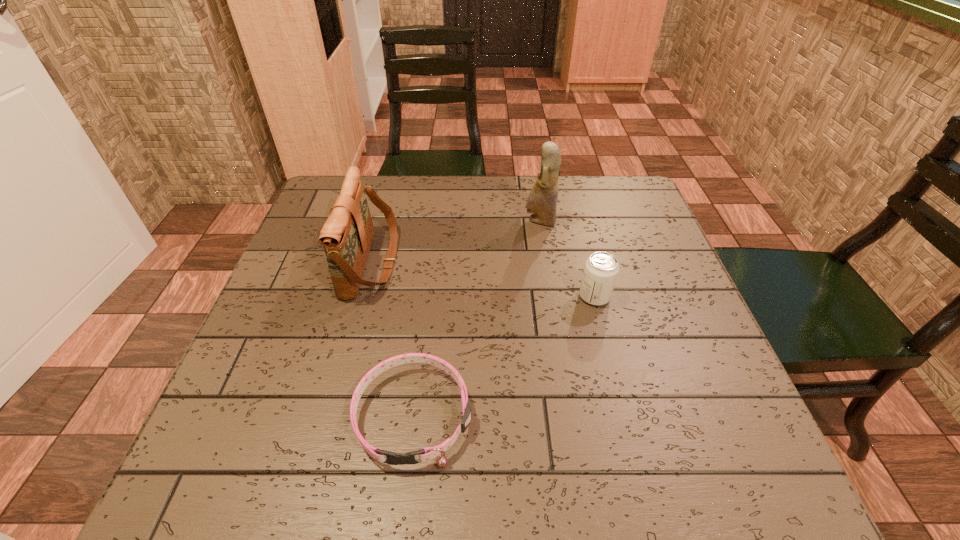
Image resolution: width=960 pixels, height=540 pixels. Find the location of `free space that is in between the figurine and the third tallest object`. free space that is in between the figurine and the third tallest object is located at coordinates (567, 259).

You are a GUI agent. You are given a task and a screenshot of the screen. Output one action in this format:
    pyautogui.click(x=<x>, y=<y>)
    Task: Click on the free space between the tallest object and the third shortest object
    
    Given the screenshot: What is the action you would take?
    pyautogui.click(x=456, y=241)

Where is `object identified as the closest to the rightmost object`? object identified as the closest to the rightmost object is located at coordinates click(x=542, y=200).

Identify the location of object identified as the closest to the tallest object. The image size is (960, 540). (601, 269).

At what (x,y) coordinates should I click in order to perform the action: click on free spot that satisfies the following two spatial constraints: 1. on the front-facing side of the figurine; 2. on the back side of the third tallest object. Please return your answer as a coordinate pair (x, y). This screenshot has width=960, height=540. Looking at the image, I should click on [x=552, y=296].

Identify the location of vacant region that satisfies the following two spatial constraints: 1. on the front-facing side of the figurine; 2. on the right side of the rightmost object. This screenshot has height=540, width=960. (552, 296).

You are a GUI agent. You are given a task and a screenshot of the screen. Output one action in this format:
    pyautogui.click(x=<x>, y=<y>)
    Task: Click on the vacant space that satisfies the following two spatial constraints: 1. on the front-facing side of the shoulder bag; 2. on the back side of the third tallest object
    Image resolution: width=960 pixels, height=540 pixels.
    Given the screenshot: What is the action you would take?
    pyautogui.click(x=363, y=296)

Find the location of a particular element. vacant space that satisfies the following two spatial constraints: 1. on the front-facing side of the shoulder bag; 2. on the right side of the rightmost object is located at coordinates (363, 296).

I want to click on free region that satisfies the following two spatial constraints: 1. on the front-facing side of the third shortest object; 2. on the back side of the soda can, so point(363,296).

Locate an element on the screen. free space that satisfies the following two spatial constraints: 1. on the front-facing side of the tallest object; 2. with the buckle on the nearest object is located at coordinates (571, 415).